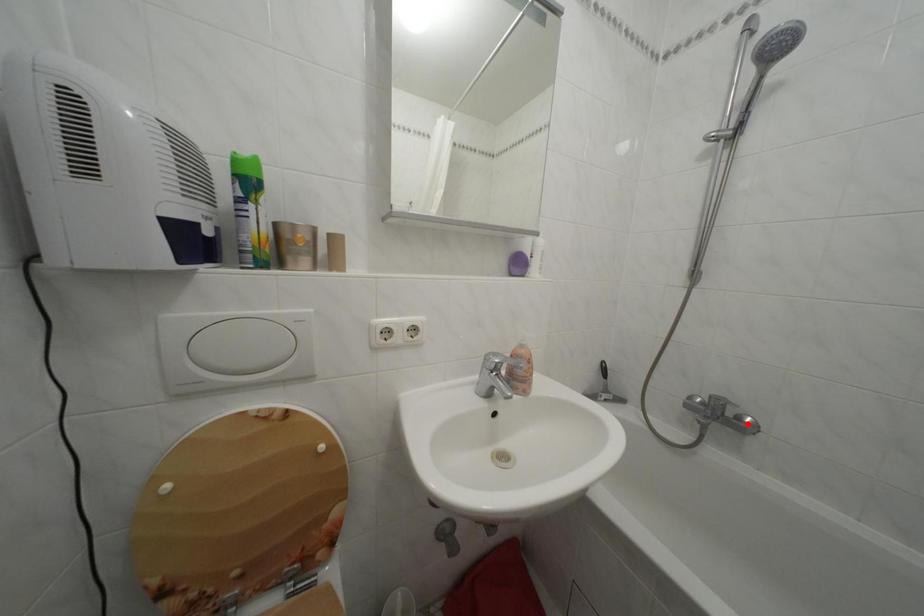
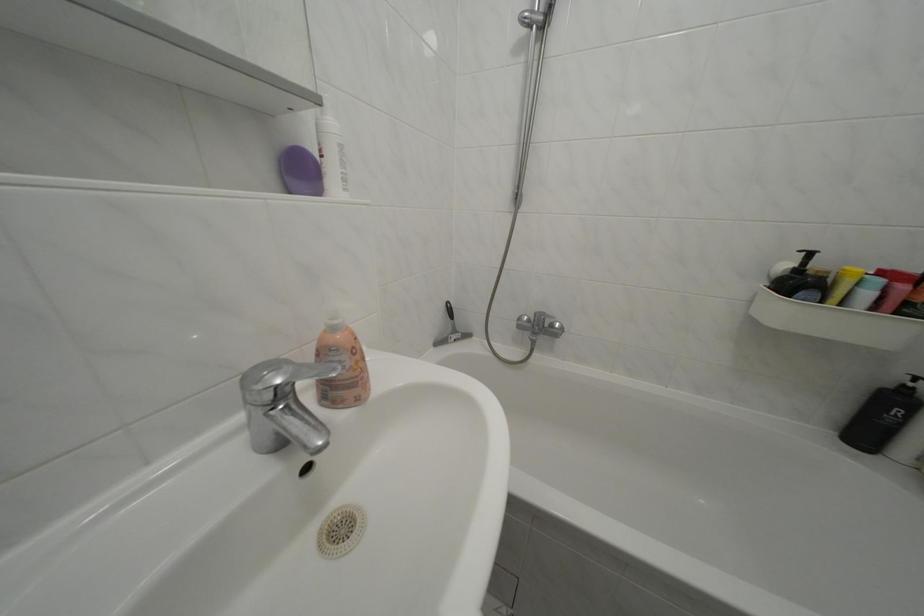
Find the pixel in the second image that matches the highlighted location in the first image.

(562, 331)